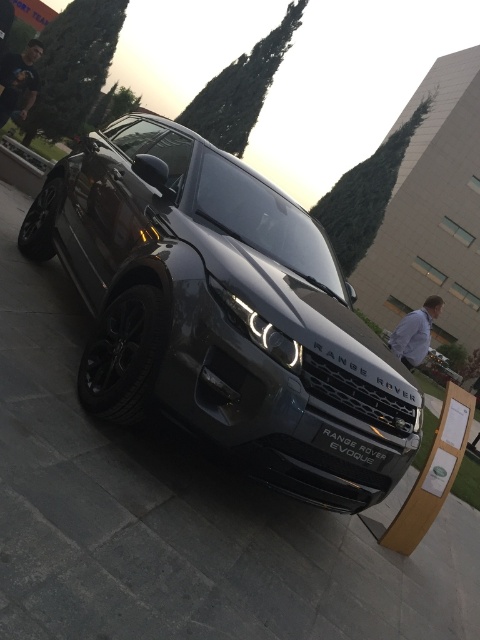
Question: Where is satin metallic range rover evoque at center located in relation to black matte range rover evoque at center in the image?

Choices:
 (A) right
 (B) left

Answer: (B)

Question: Which point appears closest to the camera in this image?

Choices:
 (A) (364, 449)
 (B) (355, 433)
 (C) (434, 307)

Answer: (B)

Question: Is satin metallic range rover evoque at center to the left of black matte range rover evoque at center from the viewer's perspective?

Choices:
 (A) yes
 (B) no

Answer: (A)

Question: Which point appears closest to the camera in this image?

Choices:
 (A) (75, 168)
 (B) (357, 444)

Answer: (B)

Question: Does satin metallic range rover evoque at center appear over satin black range rover evoque at center?

Choices:
 (A) no
 (B) yes

Answer: (B)

Question: Considering the real-world distances, which object is farthest from the satin metallic range rover evoque at center?

Choices:
 (A) black matte range rover evoque at center
 (B) satin black range rover evoque at center

Answer: (B)